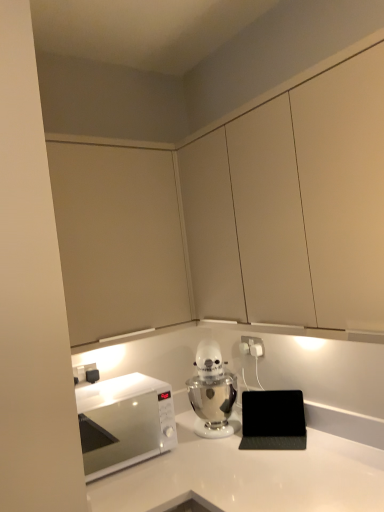
Question: Is white glossy microwave at left shorter than white glossy countertop at center?

Choices:
 (A) no
 (B) yes

Answer: (B)

Question: Is white glossy microwave at left surrounding white glossy countertop at center?

Choices:
 (A) yes
 (B) no

Answer: (B)

Question: Is white glossy microwave at left closer to the viewer compared to white glossy countertop at center?

Choices:
 (A) yes
 (B) no

Answer: (B)

Question: Is the position of white glossy microwave at left more distant than that of white glossy countertop at center?

Choices:
 (A) yes
 (B) no

Answer: (A)

Question: From the image's perspective, is white glossy microwave at left beneath white glossy countertop at center?

Choices:
 (A) yes
 (B) no

Answer: (B)

Question: From the image's perspective, is metallic silver stand mixer at center above or below white glossy microwave at left?

Choices:
 (A) above
 (B) below

Answer: (A)

Question: Is point (205, 391) positioned closer to the camera than point (152, 394)?

Choices:
 (A) farther
 (B) closer

Answer: (A)

Question: Is metallic silver stand mixer at center bigger or smaller than white glossy microwave at left?

Choices:
 (A) small
 (B) big

Answer: (A)

Question: From their relative heights in the image, would you say metallic silver stand mixer at center is taller or shorter than white glossy microwave at left?

Choices:
 (A) short
 (B) tall

Answer: (B)

Question: Considering the positions of white plastic electric outlet at center-right and white glossy microwave at left in the image, is white plastic electric outlet at center-right wider or thinner than white glossy microwave at left?

Choices:
 (A) wide
 (B) thin

Answer: (B)

Question: Considering their positions, is white plastic electric outlet at center-right located in front of or behind white glossy microwave at left?

Choices:
 (A) front
 (B) behind

Answer: (B)

Question: From their relative heights in the image, would you say white plastic electric outlet at center-right is taller or shorter than white glossy microwave at left?

Choices:
 (A) short
 (B) tall

Answer: (A)

Question: In the image, is white plastic electric outlet at center-right on the left side or the right side of white glossy microwave at left?

Choices:
 (A) left
 (B) right

Answer: (B)

Question: From a real-world perspective, is white glossy countertop at center above or below white glossy microwave at left?

Choices:
 (A) below
 (B) above

Answer: (A)

Question: Considering the positions of white glossy countertop at center and white glossy microwave at left in the image, is white glossy countertop at center wider or thinner than white glossy microwave at left?

Choices:
 (A) wide
 (B) thin

Answer: (A)